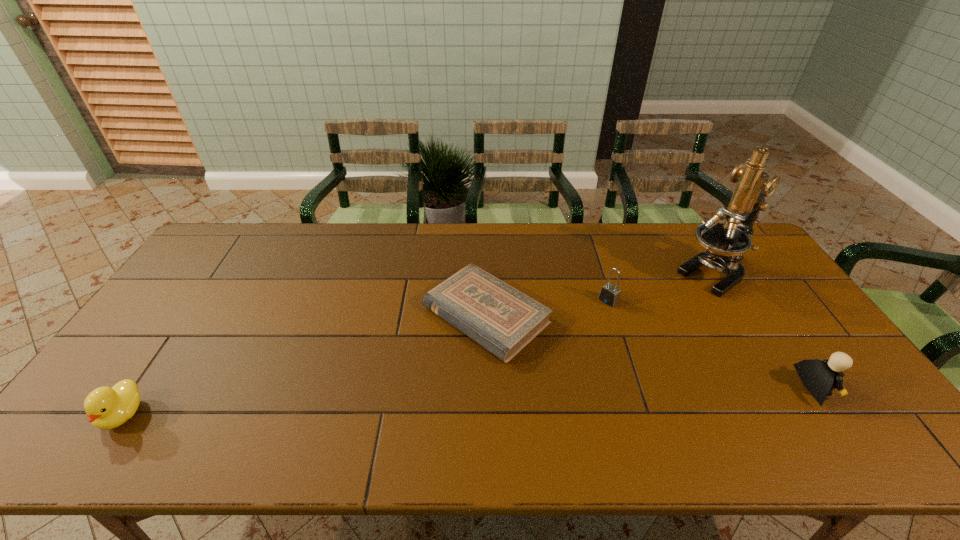
What are the coordinates of `free space on the desktop that is between the duckling and the Lego and is positioned at the eyepiece of the tallest object` in the screenshot? It's located at (541, 398).

Locate an element on the screen. The width and height of the screenshot is (960, 540). free spot on the desktop that is between the duckling and the Lego and is positioned on the shackle of the padlock is located at coordinates (483, 401).

The height and width of the screenshot is (540, 960). Find the location of `free spot on the desktop that is between the leftmost object and the Lego and is positioned on the spine side of the fourth object from right to left`. free spot on the desktop that is between the leftmost object and the Lego and is positioned on the spine side of the fourth object from right to left is located at coordinates (374, 404).